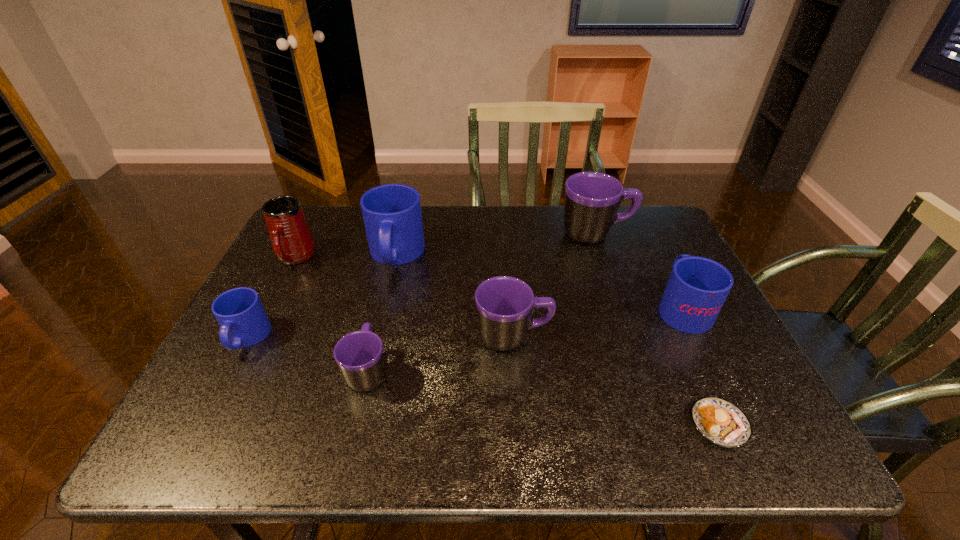
The width and height of the screenshot is (960, 540). Find the location of `free space between the biggest blue mug and the red mug`. free space between the biggest blue mug and the red mug is located at coordinates (346, 256).

Find the location of a particular element. free space between the farthest blue mug and the leftmost blue mug is located at coordinates (322, 296).

Find the location of a particular element. vacant space that's between the nearest object and the fifth mug from left to right is located at coordinates (616, 381).

Point out which object is positioned as the seventh nearest to the rightmost blue mug. Please provide its 2D coordinates. Your answer should be formatted as a tuple, i.e. [(x, y)], where the tuple contains the x and y coordinates of a point satisfying the conditions above.

[(243, 322)]

Identify which object is the closest to the pastry. Please provide its 2D coordinates. Your answer should be formatted as a tuple, i.e. [(x, y)], where the tuple contains the x and y coordinates of a point satisfying the conditions above.

[(697, 288)]

Identify the location of mug that is the fourth nearest to the rightmost blue mug. This screenshot has height=540, width=960. (359, 354).

Select which mug is the third closest to the smallest blue mug. Please provide its 2D coordinates. Your answer should be formatted as a tuple, i.e. [(x, y)], where the tuple contains the x and y coordinates of a point satisfying the conditions above.

[(392, 215)]

Find the location of `the third closest blue mug to the red mug`. the third closest blue mug to the red mug is located at coordinates (697, 288).

Find the location of a particular element. This screenshot has width=960, height=540. blue mug that is the third closest to the biggest black mug is located at coordinates (243, 322).

Locate an element on the screen. The width and height of the screenshot is (960, 540). the closest black mug relative to the farthest black mug is located at coordinates (505, 305).